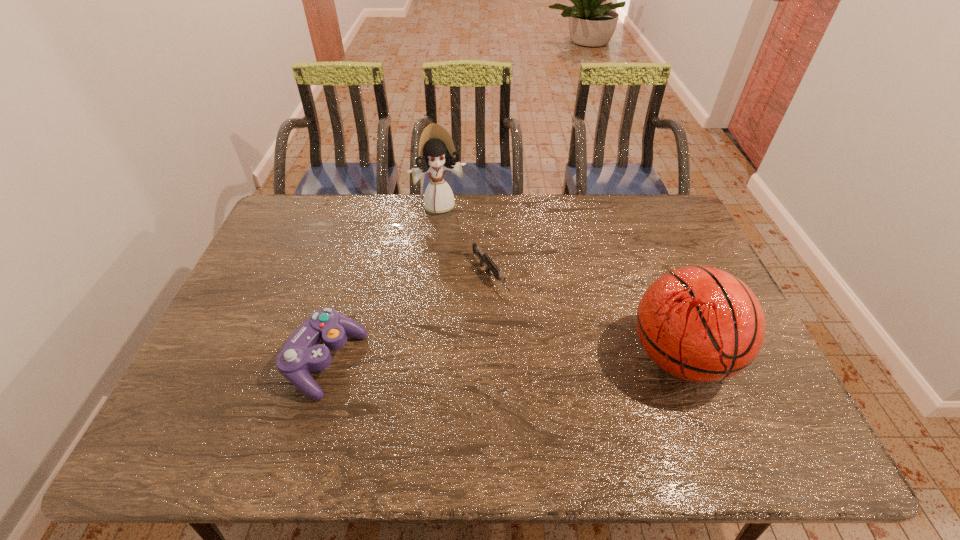
This screenshot has width=960, height=540. In order to click on the leftmost object in this screenshot , I will do `click(304, 351)`.

Locate an element on the screen. The height and width of the screenshot is (540, 960). the third tallest object is located at coordinates (304, 351).

Where is `basketball`? The height and width of the screenshot is (540, 960). basketball is located at coordinates (701, 324).

Locate an element on the screen. The width and height of the screenshot is (960, 540). the third object from right to left is located at coordinates (437, 153).

The width and height of the screenshot is (960, 540). What are the coordinates of `the farthest object` in the screenshot? It's located at (437, 153).

Where is `the third nearest object`? The height and width of the screenshot is (540, 960). the third nearest object is located at coordinates (484, 258).

What are the coordinates of `the second object from right to left` in the screenshot? It's located at [484, 258].

You are a GUI agent. You are given a task and a screenshot of the screen. Output one action in this format:
    pyautogui.click(x=<x>, y=<y>)
    Task: Click on the free space located 0.230m on the back of the leftmost object
    
    Given the screenshot: What is the action you would take?
    pyautogui.click(x=353, y=269)

Find the location of a particular element. The image size is (960, 540). vacant space located at the front face of the second object from left to right is located at coordinates (459, 258).

Locate an element on the screen. The width and height of the screenshot is (960, 540). free space located 0.260m at the front face of the second object from left to right is located at coordinates (462, 266).